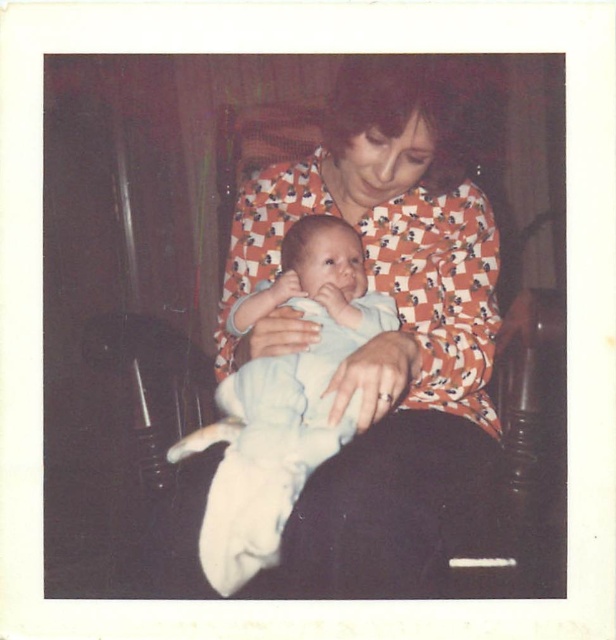
You are a photographer setting up for a portrait. You need to ensure that the orange printed blouse at center and the light blue cotton baby at center are both visible in the frame. Given their positions, which object should you focus on first to ensure proper framing?

The orange printed blouse at center is taller than the light blue cotton baby at center, so you should focus on the orange printed blouse at center first to ensure the entire height of both subjects fits within the frame.

You are a photographer trying to capture a closeup shot of the orange printed blouse at center and the light blue cotton baby at center. Your camera can focus on objects within a 4 inch range. Can you fit both subjects within the focus range?

The orange printed blouse at center and light blue cotton baby at center are 4.19 inches apart from each other. Since the distance between them exceeds the camera focus range of 4 inches, you cannot fit both subjects within the focus range.

What is the main object located at the coordinate point [386,333] in the image?

The point at coordinate [386,333] indicates the orange printed blouse at center.